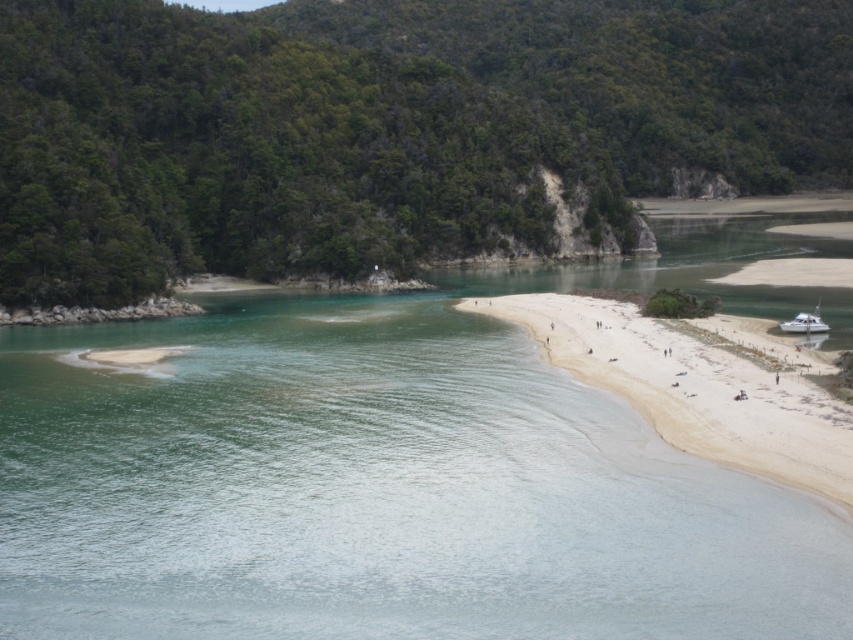
Is white sandy beach at lower right bigger than white glossy boat at lower right?

Correct, white sandy beach at lower right is larger in size than white glossy boat at lower right.

Is point (541, 328) less distant than point (820, 328)?

That is False.

Between point (817, 406) and point (801, 314), which one is positioned in front?

Point (817, 406)

Where is `white sandy beach at lower right`? This screenshot has height=640, width=853. white sandy beach at lower right is located at coordinates (699, 385).